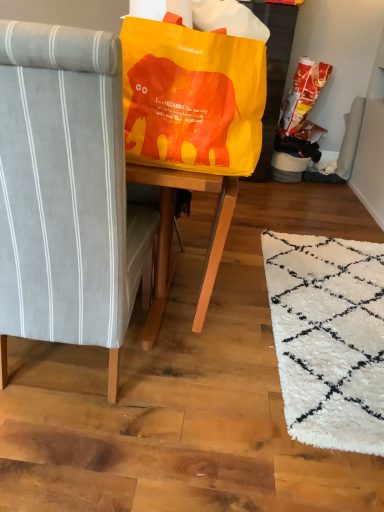
Question: Would you say matte orange plastic bag at upper right is a long distance from matte yellow bean bag chair at upper center?

Choices:
 (A) yes
 (B) no

Answer: (A)

Question: From a real-world perspective, is matte orange plastic bag at upper right beneath matte yellow bean bag chair at upper center?

Choices:
 (A) no
 (B) yes

Answer: (B)

Question: Is matte yellow bean bag chair at upper center completely or partially inside matte orange plastic bag at upper right?

Choices:
 (A) no
 (B) yes

Answer: (A)

Question: Is matte orange plastic bag at upper right looking in the opposite direction of matte yellow bean bag chair at upper center?

Choices:
 (A) yes
 (B) no

Answer: (B)

Question: From the image's perspective, is matte orange plastic bag at upper right on matte yellow bean bag chair at upper center?

Choices:
 (A) no
 (B) yes

Answer: (B)

Question: Would you say gray fabric chair at left is to the left or to the right of matte yellow bean bag chair at upper center in the picture?

Choices:
 (A) right
 (B) left

Answer: (B)

Question: From the image's perspective, is gray fabric chair at left above or below matte yellow bean bag chair at upper center?

Choices:
 (A) above
 (B) below

Answer: (B)

Question: Is gray fabric chair at left in front of or behind matte yellow bean bag chair at upper center in the image?

Choices:
 (A) behind
 (B) front

Answer: (B)

Question: From a real-world perspective, is gray fabric chair at left positioned above or below matte yellow bean bag chair at upper center?

Choices:
 (A) above
 (B) below

Answer: (B)

Question: Is matte orange plastic bag at upper right in front of or behind gray fabric chair at left in the image?

Choices:
 (A) front
 (B) behind

Answer: (B)

Question: From the image's perspective, is matte orange plastic bag at upper right positioned above or below gray fabric chair at left?

Choices:
 (A) below
 (B) above

Answer: (B)

Question: Is matte orange plastic bag at upper right to the left or to the right of gray fabric chair at left in the image?

Choices:
 (A) left
 (B) right

Answer: (B)

Question: Does point (296, 109) appear closer or farther from the camera than point (34, 74)?

Choices:
 (A) closer
 (B) farther

Answer: (B)

Question: From the image's perspective, is matte yellow bean bag chair at upper center located above or below matte orange plastic bag at upper right?

Choices:
 (A) above
 (B) below

Answer: (B)

Question: Considering their positions, is matte yellow bean bag chair at upper center located in front of or behind matte orange plastic bag at upper right?

Choices:
 (A) front
 (B) behind

Answer: (A)